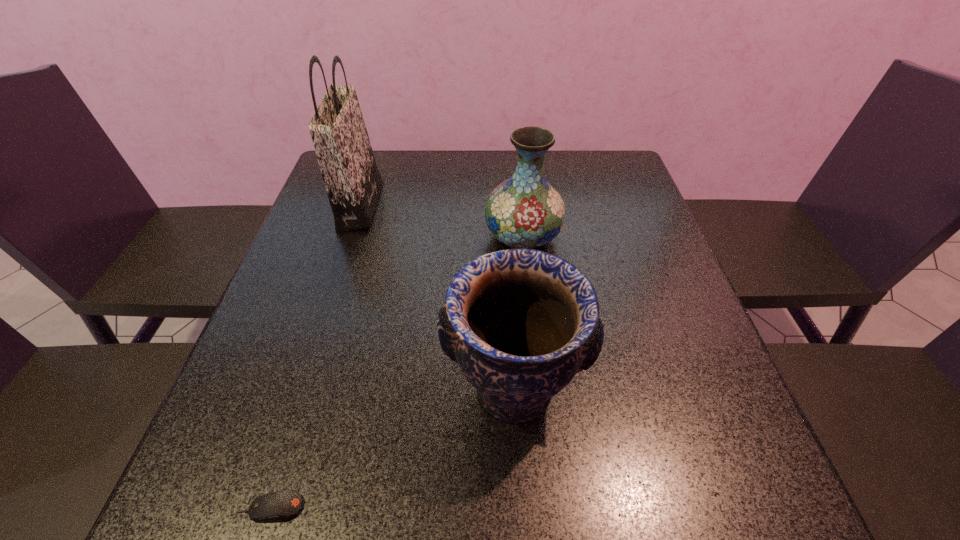
You are a GUI agent. You are given a task and a screenshot of the screen. Output one action in this format:
    pyautogui.click(x=<x>, y=<y>)
    Task: Click on the tallest object
    Image resolution: width=960 pixels, height=540 pixels.
    Given the screenshot: What is the action you would take?
    pyautogui.click(x=352, y=180)

Image resolution: width=960 pixels, height=540 pixels. Identify the location of vase. (525, 211).

Locate an element on the screen. the second nearest object is located at coordinates (521, 323).

Find the location of a particular element. This screenshot has width=960, height=540. computer mouse is located at coordinates (277, 506).

Image resolution: width=960 pixels, height=540 pixels. I want to click on the nearest object, so click(277, 506).

You are a GUI agent. You are given a task and a screenshot of the screen. Output one action in this format:
    pyautogui.click(x=<x>, y=<y>)
    Task: Click on the vacant space located 0.280m on the front of the shopping bag with the design
    The image size is (960, 540).
    Given the screenshot: What is the action you would take?
    pyautogui.click(x=482, y=206)

Identify the location of vacant space located on the left of the vase. The height and width of the screenshot is (540, 960). (452, 237).

Where is `free space located 0.330m on the back of the nearest object`? Image resolution: width=960 pixels, height=540 pixels. free space located 0.330m on the back of the nearest object is located at coordinates (328, 323).

Locate an element on the screen. Image resolution: width=960 pixels, height=540 pixels. object at the far edge is located at coordinates (352, 180).

The height and width of the screenshot is (540, 960). I want to click on object located at the near edge, so click(277, 506).